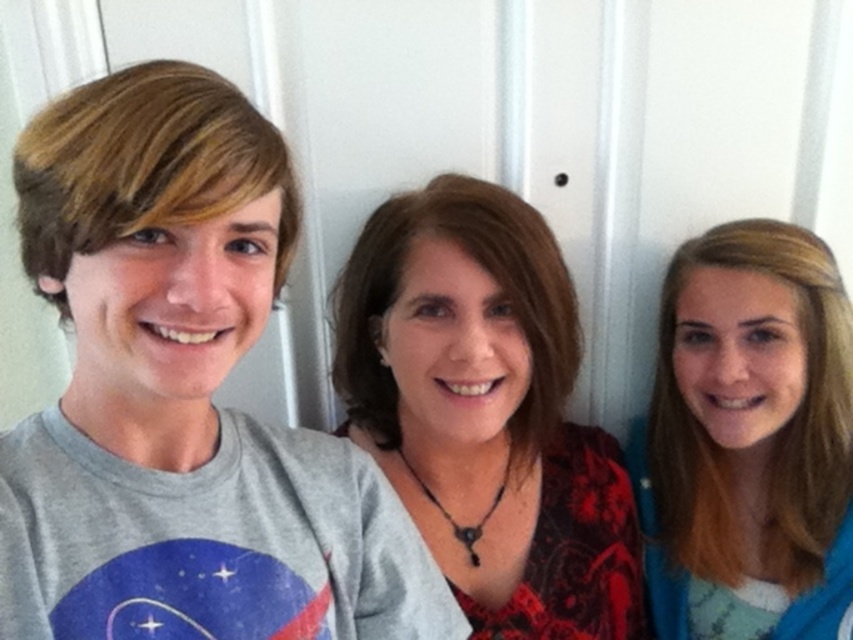
Question: Can you confirm if gray cotton t-shirt at left is positioned below matte red blouse at center?

Choices:
 (A) yes
 (B) no

Answer: (B)

Question: Does gray cotton t-shirt at left appear on the left side of blonde hair at right?

Choices:
 (A) yes
 (B) no

Answer: (A)

Question: Estimate the real-world distances between objects in this image. Which object is closer to the matte red blouse at center?

Choices:
 (A) blonde hair at right
 (B) gray cotton t-shirt at left

Answer: (A)

Question: Which of the following is the farthest from the observer?

Choices:
 (A) (550, 353)
 (B) (851, 502)

Answer: (B)

Question: Which point is farther to the camera?

Choices:
 (A) blonde hair at right
 (B) gray cotton t-shirt at left

Answer: (A)

Question: Does matte red blouse at center have a greater width compared to blonde hair at right?

Choices:
 (A) yes
 (B) no

Answer: (A)